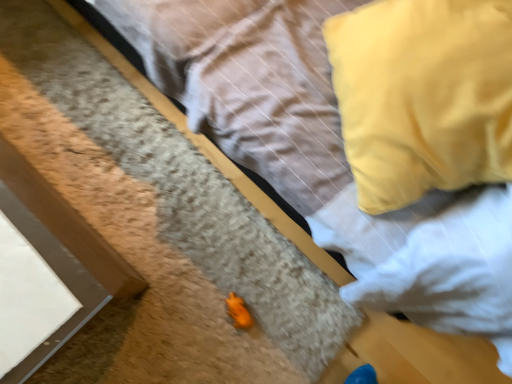
Question: Looking at the image, does yellow fabric pillow at upper right seem bigger or smaller compared to orange matte toy frog at lower center?

Choices:
 (A) big
 (B) small

Answer: (A)

Question: Would you say yellow fabric pillow at upper right is inside or outside orange matte toy frog at lower center?

Choices:
 (A) outside
 (B) inside

Answer: (A)

Question: Is yellow fabric pillow at upper right wider or thinner than orange matte toy frog at lower center?

Choices:
 (A) wide
 (B) thin

Answer: (A)

Question: From the image's perspective, is orange matte toy frog at lower center above or below yellow fabric pillow at upper right?

Choices:
 (A) below
 (B) above

Answer: (A)

Question: In the image, is orange matte toy frog at lower center positioned in front of or behind yellow fabric pillow at upper right?

Choices:
 (A) behind
 (B) front

Answer: (A)

Question: From a real-world perspective, relative to yellow fabric pillow at upper right, is orange matte toy frog at lower center vertically above or below?

Choices:
 (A) below
 (B) above

Answer: (A)

Question: Considering the relative positions of orange matte toy frog at lower center and yellow fabric pillow at upper right in the image provided, is orange matte toy frog at lower center to the left or to the right of yellow fabric pillow at upper right?

Choices:
 (A) right
 (B) left

Answer: (B)